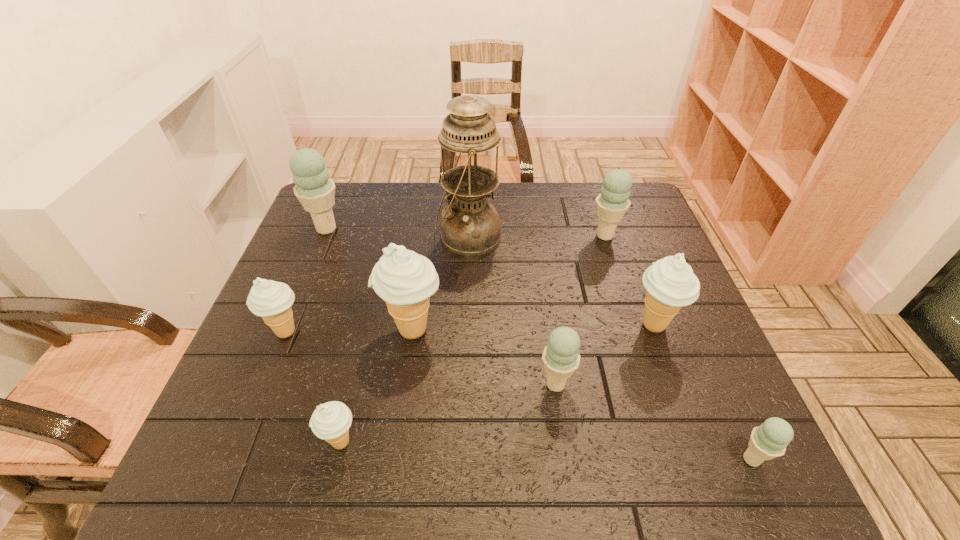
Identify the location of free spot between the biggest blue ice cream and the nearest beige icecream. The width and height of the screenshot is (960, 540). (333, 335).

The image size is (960, 540). What are the coordinates of `free space between the smallest beige icecream and the second smallest beige icecream` in the screenshot? It's located at (313, 387).

The image size is (960, 540). I want to click on free space between the rightmost beige icecream and the oil lamp, so click(562, 281).

Find the location of a particular element. This screenshot has height=540, width=960. free space that is in between the leftmost blue ice cream and the tallest object is located at coordinates point(397,233).

This screenshot has width=960, height=540. Find the location of `free space between the third blue ice cream from right to left and the biggest blue ice cream`. free space between the third blue ice cream from right to left and the biggest blue ice cream is located at coordinates (441, 306).

Locate an element on the screen. empty location between the biggest beige icecream and the second nearest blue ice cream is located at coordinates (484, 357).

The width and height of the screenshot is (960, 540). I want to click on vacant area that lies between the tallest object and the second biggest blue ice cream, so click(537, 236).

Where is `empty space between the biggest blue ice cream and the fifth ice cream from left to right`? empty space between the biggest blue ice cream and the fifth ice cream from left to right is located at coordinates (441, 306).

Find the location of `free spot between the rightmost blue ice cream and the oil lamp`. free spot between the rightmost blue ice cream and the oil lamp is located at coordinates (611, 348).

At what (x,y) coordinates should I click in order to perform the action: click on free space between the fourth object from right to left and the biggest beige icecream. Please return your answer as a coordinate pair (x, y). The height and width of the screenshot is (540, 960). Looking at the image, I should click on (484, 357).